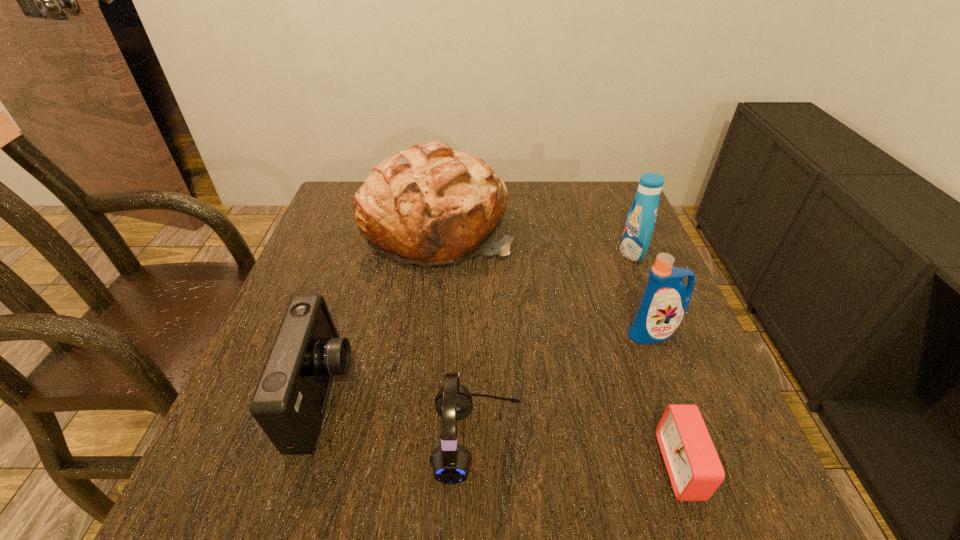
You are a GUI agent. You are given a task and a screenshot of the screen. Output one action in this format:
    pyautogui.click(x=<x>, y=<y>)
    Task: Click on the vacant region located on the label of the third farthest object
    
    Given the screenshot: What is the action you would take?
    click(x=679, y=401)

I want to click on vacant space situated 0.110m on the front-facing side of the camera, so click(413, 397).

Find the location of `vacant space located on the ear cushions of the headset`. vacant space located on the ear cushions of the headset is located at coordinates (708, 441).

The height and width of the screenshot is (540, 960). What are the coordinates of `vacant region located on the front-facing side of the shortest object` in the screenshot? It's located at (507, 466).

Find the location of a particular element. This screenshot has height=540, width=960. free space located on the front-facing side of the shortest object is located at coordinates [532, 466].

The height and width of the screenshot is (540, 960). In order to click on free spot located 0.300m on the front-facing side of the shortest object in this screenshot , I will do `click(475, 466)`.

Find the location of a particular element. The image size is (960, 540). object located at the far edge is located at coordinates (428, 205).

I want to click on headset situated at the near edge, so click(451, 463).

Locate an element on the screen. This screenshot has width=960, height=540. alarm clock at the near edge is located at coordinates (695, 471).

Identify the location of bread located in the left edge section of the desktop. Image resolution: width=960 pixels, height=540 pixels. (428, 205).